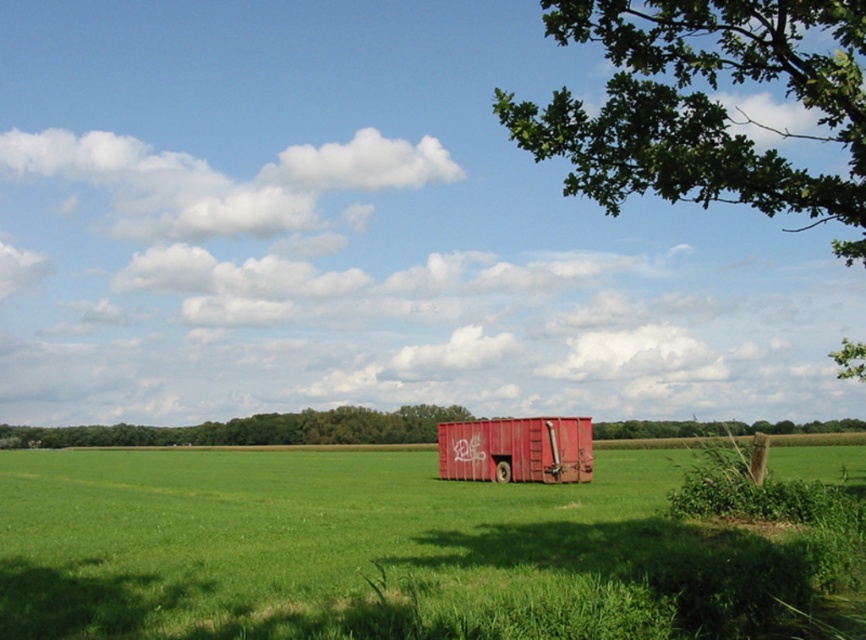
Question: Is green grassy field at center above green leafy tree at lower right?

Choices:
 (A) no
 (B) yes

Answer: (B)

Question: Can you confirm if green leafy tree at lower right is positioned above rusty metal train car at center?

Choices:
 (A) no
 (B) yes

Answer: (A)

Question: Which object is the closest to the green grassy field at center?

Choices:
 (A) rusty metal train car at center
 (B) green leafy tree at upper right

Answer: (A)

Question: Estimate the real-world distances between objects in this image. Which object is closer to the rusty metal train car at center?

Choices:
 (A) green leafy tree at upper right
 (B) green leafy tree at lower right
 (C) green grassy field at center

Answer: (C)

Question: Which point appears farthest from the camera in this image?

Choices:
 (A) (569, 435)
 (B) (825, 124)
 (C) (49, 429)
 (D) (479, 518)

Answer: (C)

Question: Can you confirm if green grassy field at center is bigger than green leafy tree at upper right?

Choices:
 (A) no
 (B) yes

Answer: (A)